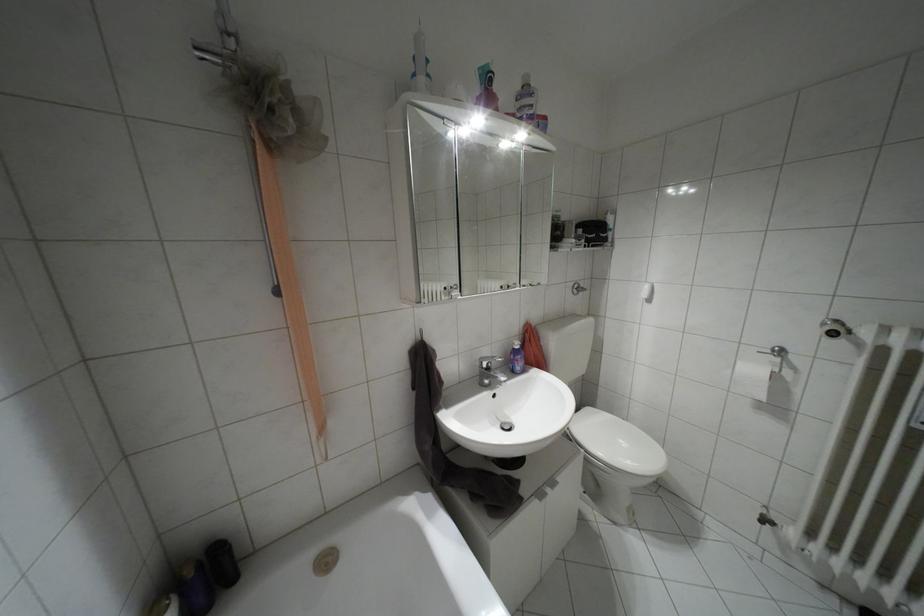
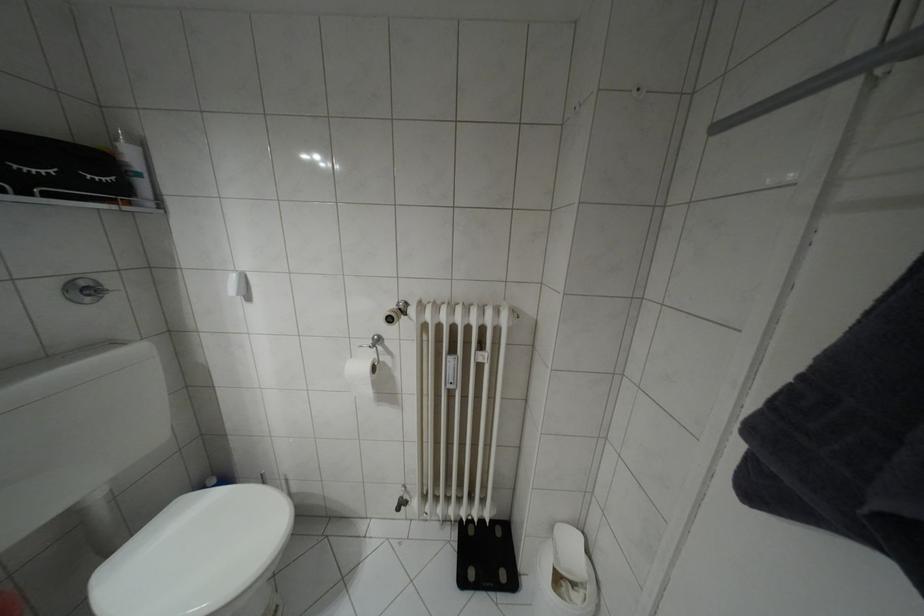
In the second image, find the point that corresponds to point 605,214 in the first image.

(116, 139)